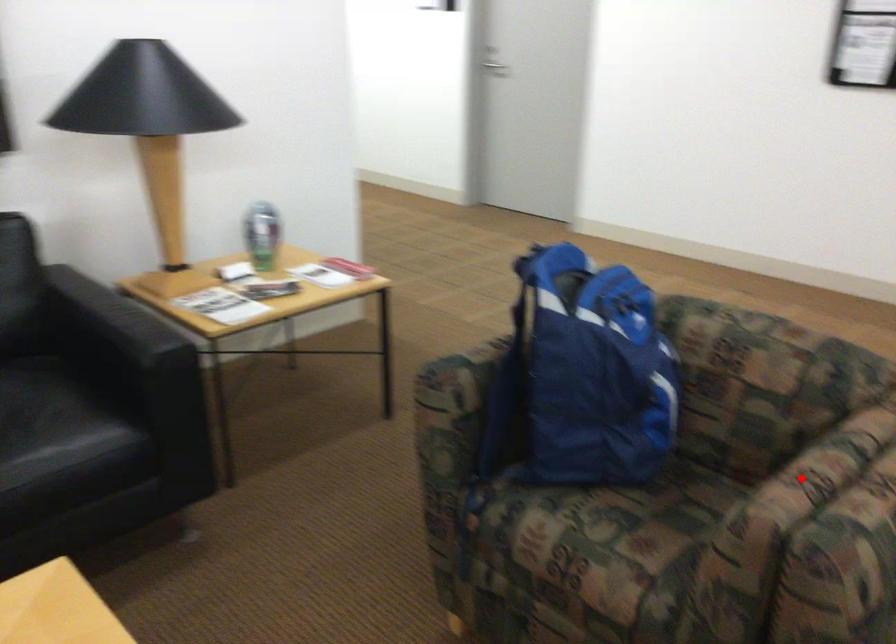
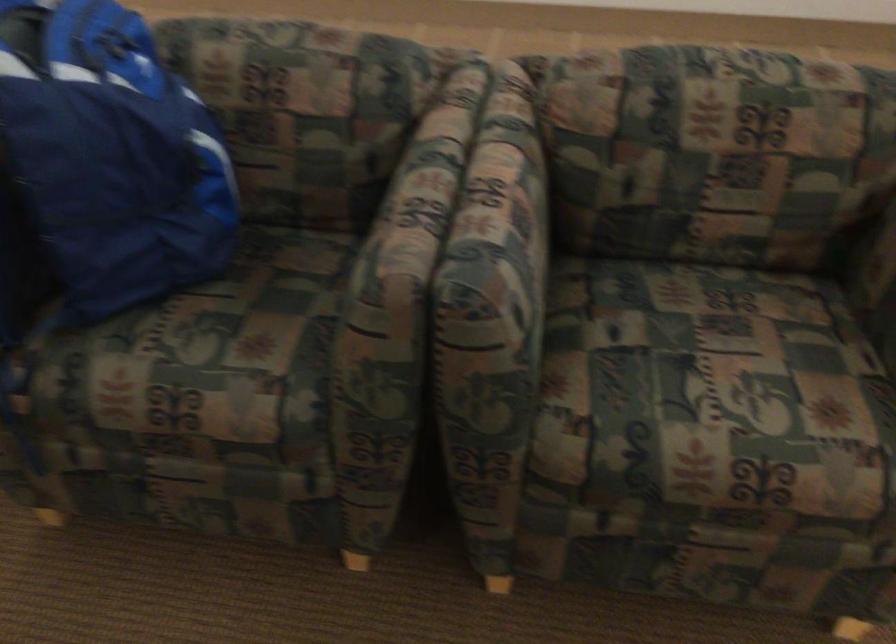
Question: I am providing you with two images of the same scene from different viewpoints. A red point is shown in image1. For the corresponding object point in image2, is it positioned nearer or farther from the camera?

Choices:
 (A) Nearer
 (B) Farther

Answer: (A)